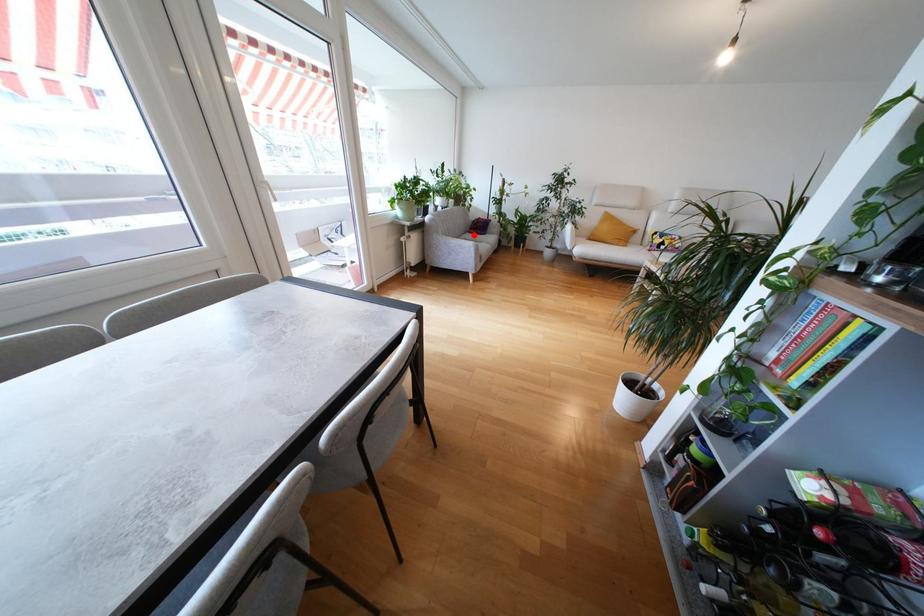
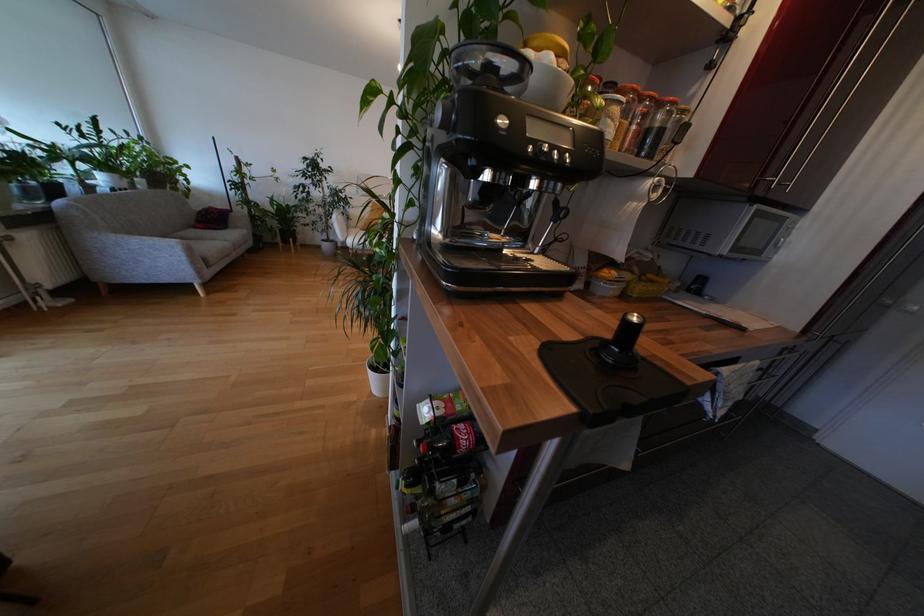
Question: I am providing you with two images of the same scene from different viewpoints. In image1, a red point is highlighted. Considering the same 3D point in image2, which of the following is correct?

Choices:
 (A) It is closer
 (B) It is farther

Answer: (A)